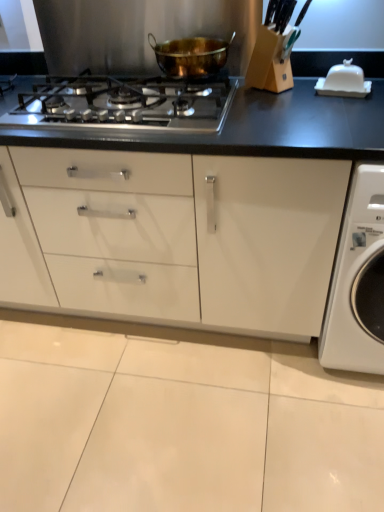
Question: Considering the relative positions of white glossy washing machine at right and gold metallic pot at center in the image provided, is white glossy washing machine at right to the left or to the right of gold metallic pot at center?

Choices:
 (A) left
 (B) right

Answer: (B)

Question: Based on their sizes in the image, would you say white glossy washing machine at right is bigger or smaller than gold metallic pot at center?

Choices:
 (A) small
 (B) big

Answer: (B)

Question: Estimate the real-world distances between objects in this image. Which object is closer to the gold metallic pot at center?

Choices:
 (A) satin silver gas stove at center
 (B) white glossy washing machine at right

Answer: (A)

Question: Which of these objects is positioned closest to the satin silver gas stove at center?

Choices:
 (A) white glossy washing machine at right
 (B) gold metallic pot at center

Answer: (B)